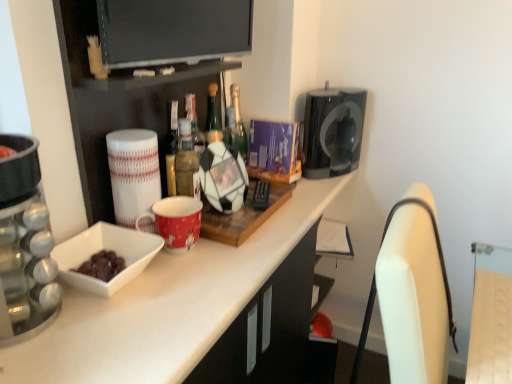
Find the location of a particular element. Image resolution: width=512 pixels, height=384 pixels. vacant point to the right of red glossy mug at center is located at coordinates (245, 253).